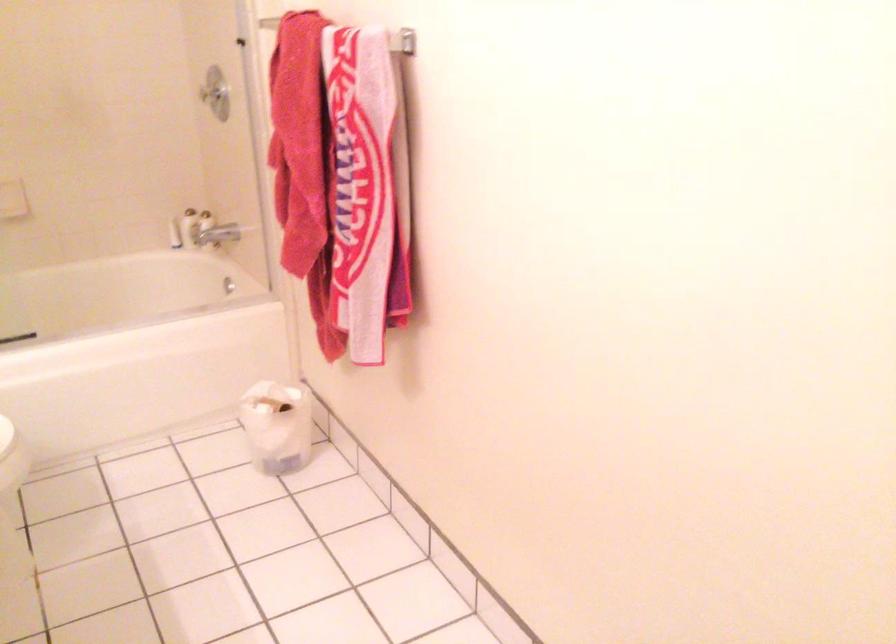
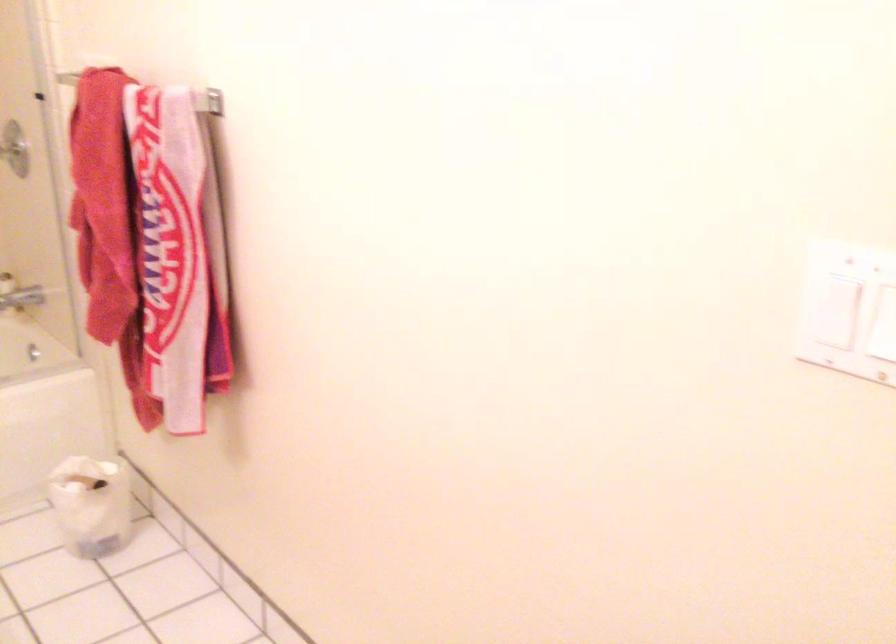
Question: The camera is either moving clockwise (left) or counter-clockwise (right) around the object. The first image is from the beginning of the video and the second image is from the end. Is the camera moving left or right when shooting the video?

Choices:
 (A) Left
 (B) Right

Answer: (A)